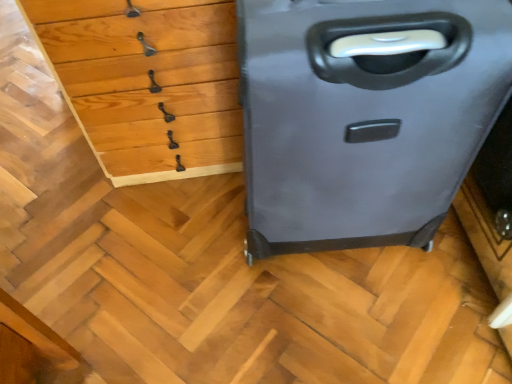
Identify the location of free space in front of wooden chest of drawers at upper left. (145, 249).